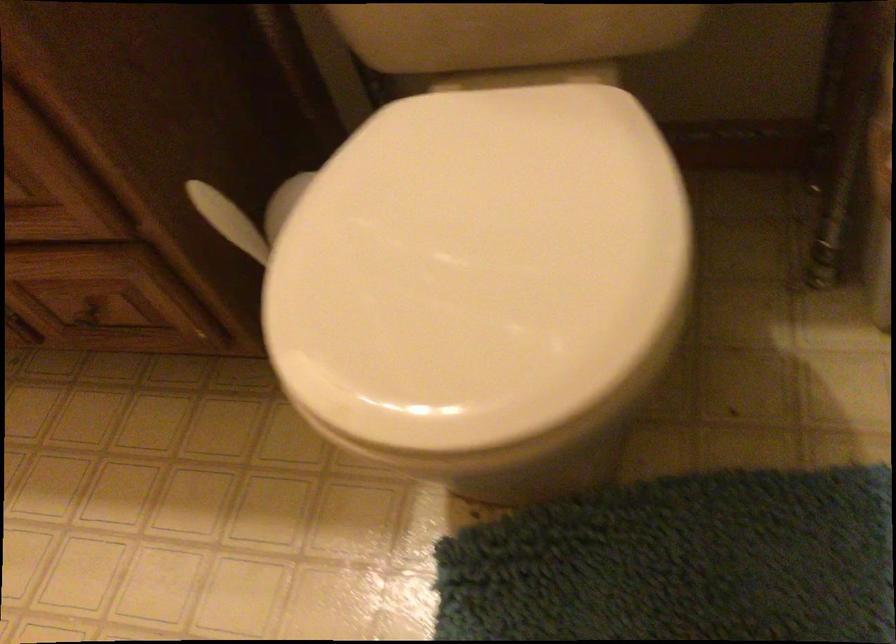
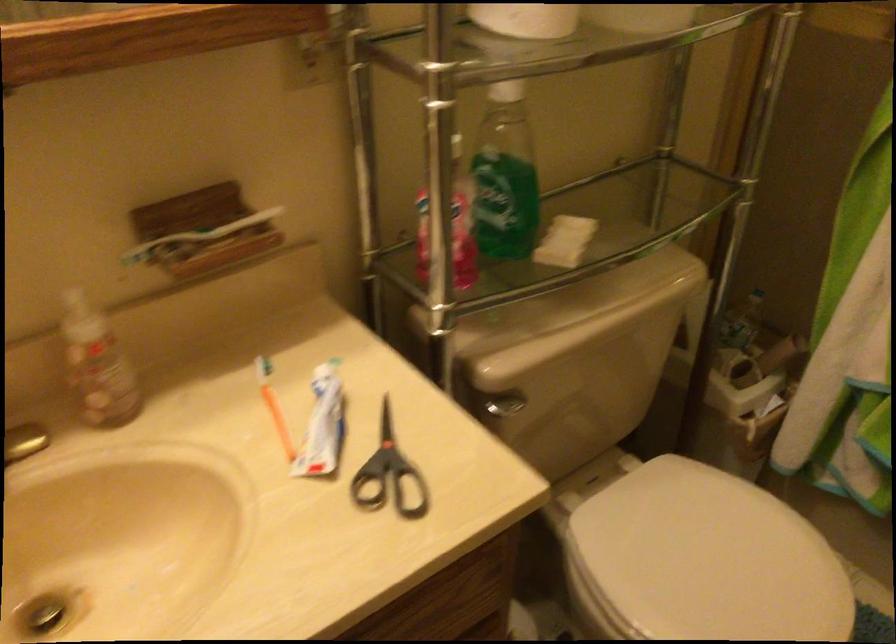
Locate, in the second image, the point that corresponds to (x=417, y=230) in the first image.

(702, 560)